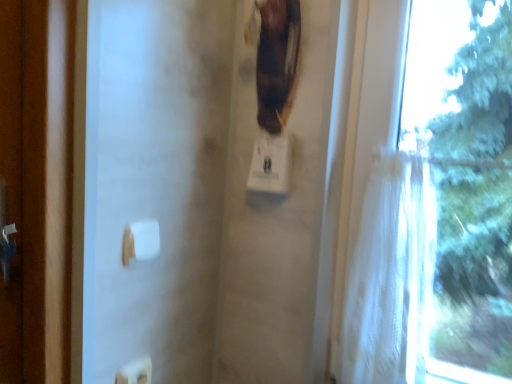
Describe the element at coordinates (141, 241) in the screenshot. This screenshot has width=512, height=384. I see `white plastic towel bar at lower center` at that location.

The width and height of the screenshot is (512, 384). What do you see at coordinates (396, 275) in the screenshot?
I see `white sheer curtain at right` at bounding box center [396, 275].

What do you see at coordinates (135, 371) in the screenshot?
I see `white plastic light switch at lower center` at bounding box center [135, 371].

The height and width of the screenshot is (384, 512). Find the location of `white plastic towel bar at lower center`. white plastic towel bar at lower center is located at coordinates [141, 241].

Could you tell me if white sheer curtain at right is facing white plastic towel bar at lower center?

No, white sheer curtain at right is not oriented towards white plastic towel bar at lower center.

Would you say white sheer curtain at right contains white plastic towel bar at lower center?

No, white plastic towel bar at lower center is located outside of white sheer curtain at right.

From the image's perspective, which object appears higher, white sheer curtain at right or white plastic towel bar at lower center?

white sheer curtain at right.

Is white sheer curtain at right thinner than white plastic towel bar at lower center?

No.

Consider the image. Considering the relative sizes of white sheer fabric at right and white sheer curtain at right in the image provided, is white sheer fabric at right thinner than white sheer curtain at right?

No, white sheer fabric at right is not thinner than white sheer curtain at right.

What's the angular difference between white sheer fabric at right and white sheer curtain at right's facing directions?

white sheer fabric at right and white sheer curtain at right are facing 1.72 degrees away from each other.

Does white sheer fabric at right appear on the left side of white sheer curtain at right?

Indeed, white sheer fabric at right is positioned on the left side of white sheer curtain at right.

Considering the sizes of white sheer fabric at right and white sheer curtain at right in the image, is white sheer fabric at right bigger or smaller than white sheer curtain at right?

Considering their sizes, white sheer fabric at right takes up less space than white sheer curtain at right.

Can you see white sheer curtain at right touching brown leather guitar at upper center?

No, white sheer curtain at right is not in contact with brown leather guitar at upper center.

Which of these two, white sheer curtain at right or brown leather guitar at upper center, stands shorter?

brown leather guitar at upper center is shorter.

Could you tell me if white sheer curtain at right is turned towards brown leather guitar at upper center?

No, white sheer curtain at right is not turned towards brown leather guitar at upper center.

How many degrees apart are the facing directions of white sheer curtain at right and brown leather guitar at upper center?

They differ by 9.19 degrees in their facing directions.

In the scene shown: Which is correct: white sheer fabric at right is inside brown leather guitar at upper center, or outside of it?

The correct answer is: outside.

Locate an element on the screen. This screenshot has height=384, width=512. shower curtain lying below the brown leather guitar at upper center (from the image's perspective) is located at coordinates (391, 274).

Are white sheer fabric at right and brown leather guitar at upper center beside each other?

white sheer fabric at right is not next to brown leather guitar at upper center, and they're not touching.

Is white sheer fabric at right to the left of brown leather guitar at upper center from the viewer's perspective?

No.

Which object is closer to the camera taking this photo, brown leather guitar at upper center or white plastic towel bar at lower center?

white plastic towel bar at lower center is more forward.

Is point (287, 107) closer to viewer compared to point (134, 238)?

That is False.

Between brown leather guitar at upper center and white plastic towel bar at lower center, which one has larger size?

With larger size is brown leather guitar at upper center.

From the image's perspective, which one is positioned lower, white sheer curtain at right or white sheer fabric at right?

white sheer fabric at right.

From a real-world perspective, between white sheer curtain at right and white sheer fabric at right, who is vertically higher?

white sheer curtain at right, from a real-world perspective.

Is point (355, 365) closer or farther from the camera than point (402, 257)?

Clearly, point (355, 365) is more distant from the camera than point (402, 257).

This screenshot has width=512, height=384. In order to click on shower curtain that appears behind the white sheer curtain at right in this screenshot , I will do `click(391, 274)`.

Looking at this image, from the image's perspective, is white sheer curtain at right on top of white plastic light switch at lower center?

Yes, from the image's perspective, white sheer curtain at right is above white plastic light switch at lower center.

Is white sheer curtain at right placed right next to white plastic light switch at lower center?

No, white sheer curtain at right is not with white plastic light switch at lower center.

Between point (374, 306) and point (135, 365), which one is positioned in front?

The point (135, 365) is in front.

Find the location of a particular element. This screenshot has width=512, height=384. towel bar beneath the white sheer curtain at right (from a real-world perspective) is located at coordinates (141, 241).

The image size is (512, 384). I want to click on window that is above the white sheer fabric at right (from a real-world perspective), so click(x=396, y=275).

From the image, which object appears to be farther from white sheer fabric at right, white plastic towel bar at lower center or white plastic light switch at lower center?

white plastic light switch at lower center.

When comparing their distances from white plastic light switch at lower center, does white sheer curtain at right or white sheer fabric at right seem closer?

Based on the image, white sheer fabric at right appears to be nearer to white plastic light switch at lower center.

From the image, which object appears to be farther from brown leather guitar at upper center, white sheer fabric at right or white plastic light switch at lower center?

The object further to brown leather guitar at upper center is white plastic light switch at lower center.

Which object lies further to the anchor point white sheer fabric at right, brown leather guitar at upper center or white plastic towel bar at lower center?

white plastic towel bar at lower center lies further to white sheer fabric at right than the other object.

From the image, which object appears to be nearer to white sheer fabric at right, white sheer curtain at right or white plastic light switch at lower center?

The object closer to white sheer fabric at right is white sheer curtain at right.

When comparing their distances from white sheer fabric at right, does white plastic light switch at lower center or white plastic towel bar at lower center seem closer?

Based on the image, white plastic towel bar at lower center appears to be nearer to white sheer fabric at right.

Considering their positions, is brown leather guitar at upper center positioned further to white sheer fabric at right than white plastic light switch at lower center?

white plastic light switch at lower center is positioned further to the anchor white sheer fabric at right.

Based on their spatial positions, is white plastic towel bar at lower center or brown leather guitar at upper center closer to white sheer curtain at right?

Among the two, brown leather guitar at upper center is located nearer to white sheer curtain at right.

Locate an element on the screen. This screenshot has width=512, height=384. shower curtain between white plastic light switch at lower center and white sheer curtain at right is located at coordinates (391, 274).

The width and height of the screenshot is (512, 384). I want to click on shower curtain between white plastic towel bar at lower center and white sheer curtain at right in the horizontal direction, so click(391, 274).

At what (x,y) coordinates should I click in order to perform the action: click on window between brown leather guitar at upper center and white sheer fabric at right vertically. Please return your answer as a coordinate pair (x, y). The height and width of the screenshot is (384, 512). Looking at the image, I should click on (396, 275).

Locate an element on the screen. towel bar located between white plastic light switch at lower center and white sheer fabric at right in the left-right direction is located at coordinates (141, 241).